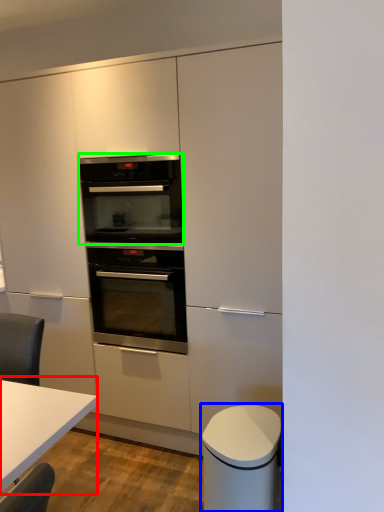
Question: Which object is the closest to the table (highlighted by a red box)? Choose among these: cabinetry (highlighted by a blue box) or oven (highlighted by a green box).

Choices:
 (A) cabinetry
 (B) oven

Answer: (A)